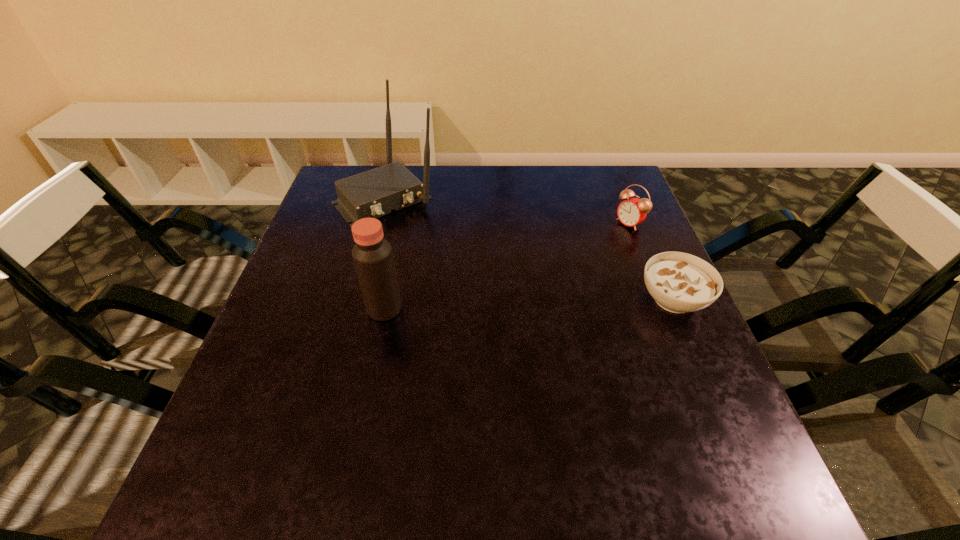
Locate an element on the screen. blank space located 0.140m on the back of the tallest object to connect cables is located at coordinates (438, 251).

Where is `vacant space positioned 0.050m on the back of the tallest object to connect cables`? vacant space positioned 0.050m on the back of the tallest object to connect cables is located at coordinates (420, 232).

The height and width of the screenshot is (540, 960). Find the location of `object that is at the far edge`. object that is at the far edge is located at coordinates (374, 193).

Where is `object at the left edge`? The image size is (960, 540). object at the left edge is located at coordinates (374, 193).

Identify the location of soup bowl positioned at the right edge. (679, 282).

Identify the location of alarm clock at the right edge. Image resolution: width=960 pixels, height=540 pixels. (633, 211).

Image resolution: width=960 pixels, height=540 pixels. What are the coordinates of `object situated at the far left corner` in the screenshot? It's located at (374, 193).

The width and height of the screenshot is (960, 540). In the image, there is a desktop. Identify the location of free space at the far edge. (579, 209).

At what (x,y) coordinates should I click in order to perform the action: click on vacant space at the near edge of the desktop. Please return your answer as a coordinate pair (x, y). This screenshot has height=540, width=960. Looking at the image, I should click on (372, 405).

This screenshot has height=540, width=960. Find the location of `free space at the left edge of the desktop`. free space at the left edge of the desktop is located at coordinates (315, 376).